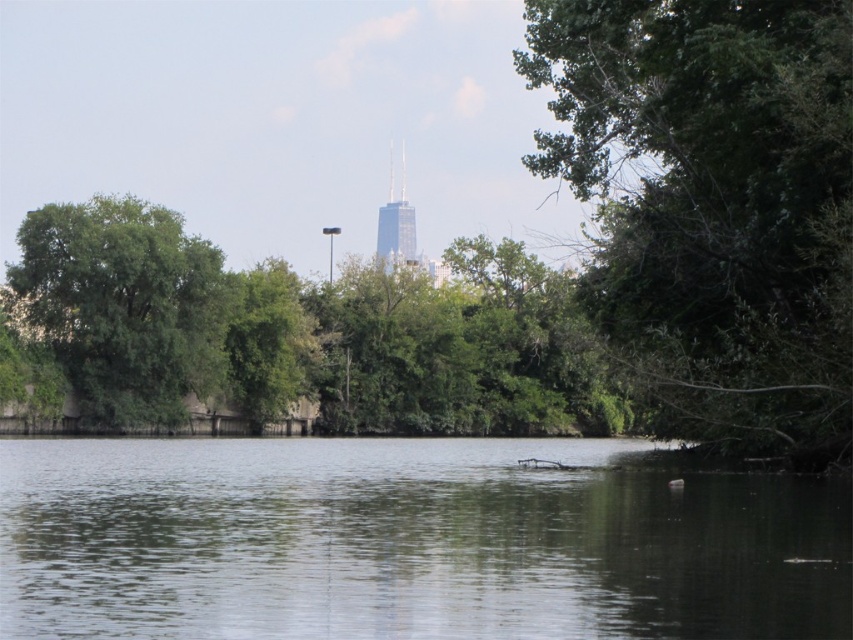
Question: Does green reflective water at center have a larger size compared to green leafy tree at left?

Choices:
 (A) yes
 (B) no

Answer: (A)

Question: Can you confirm if green leafy tree at right is wider than green leafy tree at left?

Choices:
 (A) no
 (B) yes

Answer: (A)

Question: Which object is farther from the camera taking this photo?

Choices:
 (A) green leafy tree at right
 (B) green reflective water at center
 (C) green leafy tree at left

Answer: (C)

Question: Among these objects, which one is farthest from the camera?

Choices:
 (A) green leafy tree at right
 (B) green leafy tree at left

Answer: (B)

Question: Which is farther from the green reflective water at center?

Choices:
 (A) green leafy tree at left
 (B) green leafy tree at right

Answer: (A)

Question: Is green reflective water at center above green leafy tree at right?

Choices:
 (A) yes
 (B) no

Answer: (B)